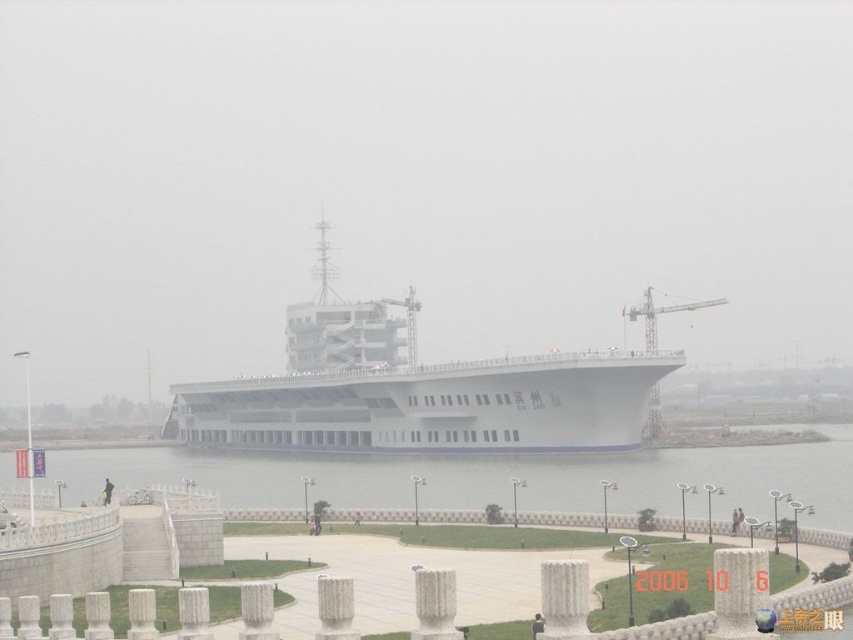
You are a photographer planning to capture the white matte aircraft carrier at center and the clear water at lower center in a single shot. Which object should you focus on first if you want to ensure both are in sharp focus, considering their sizes?

The white matte aircraft carrier at center is smaller than the clear water at lower center, so you should focus on the white matte aircraft carrier at center first to ensure both are in sharp focus.

You are standing on the viewing platform near the white matte aircraft carrier at center and the clear water at lower center. If you look down, which object will you see first as you descend vertically from your current position?

The clear water at lower center will be seen first because the white matte aircraft carrier at center is located above it, meaning the water is positioned lower down.

You are standing on the viewing platform and want to take a photo of both the point at coordinates point (332,342) and point (699,483). Which point will appear closer to the edge of your camera frame?

Point (699,483) will appear closer to the edge of your camera frame because it is farther from the camera compared to point (332,342).